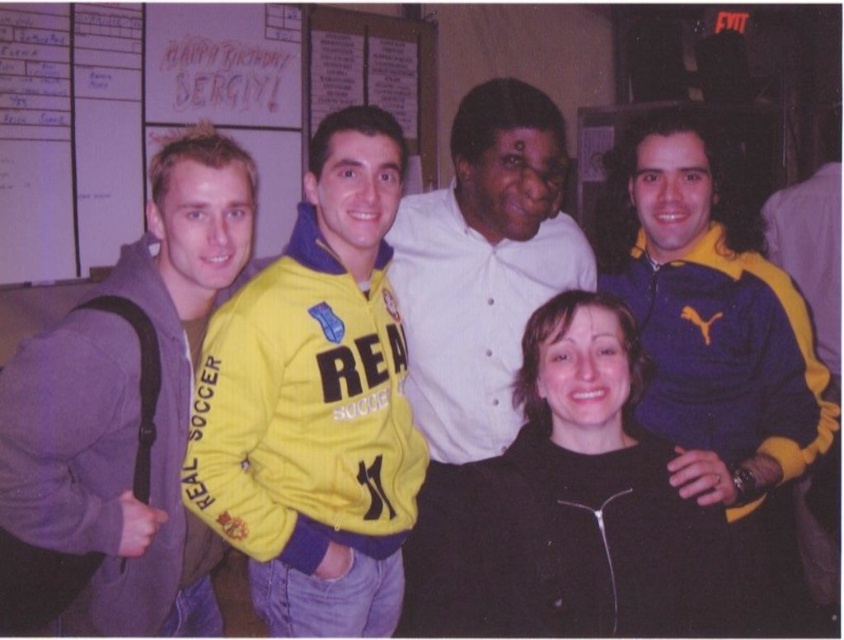
The height and width of the screenshot is (640, 844). Identify the location of yellow fleece jacket at center. tap(316, 403).

Based on the photo, does yellow fleece jacket at center have a larger size compared to blue/yellow track jacket at right?

No.

Is point (354, 477) behind point (699, 300)?

No, it is in front of (699, 300).

What are the coordinates of `yellow fleece jacket at center` in the screenshot? It's located at (316, 403).

Can you confirm if yellow fleece jacket at center is bigger than white shirt at center?

Incorrect, yellow fleece jacket at center is not larger than white shirt at center.

Between yellow fleece jacket at center and white shirt at center, which one appears on the left side from the viewer's perspective?

From the viewer's perspective, yellow fleece jacket at center appears more on the left side.

Is point (306, 451) behind point (422, 561)?

No, (306, 451) is in front of (422, 561).

Locate an element on the screen. This screenshot has height=640, width=844. yellow fleece jacket at center is located at coordinates (316, 403).

Is gray fleece jacket at left shorter than black matte jacket at center?

In fact, gray fleece jacket at left may be taller than black matte jacket at center.

Is point (104, 628) positioned behind point (572, 477)?

Yes, point (104, 628) is behind point (572, 477).

Measure the distance between point (116, 465) and camera.

1.47 meters

Identify the location of gray fleece jacket at left. The height and width of the screenshot is (640, 844). (128, 406).